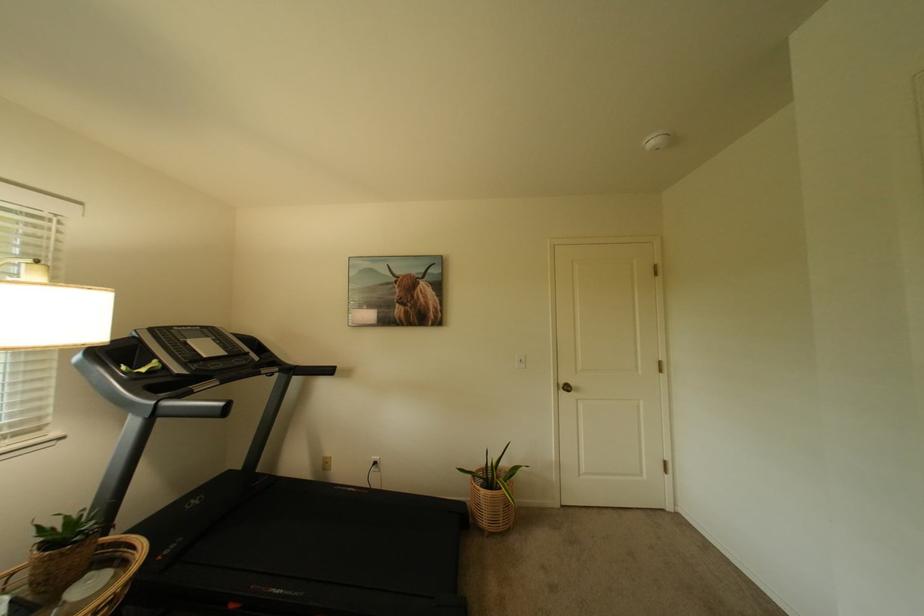
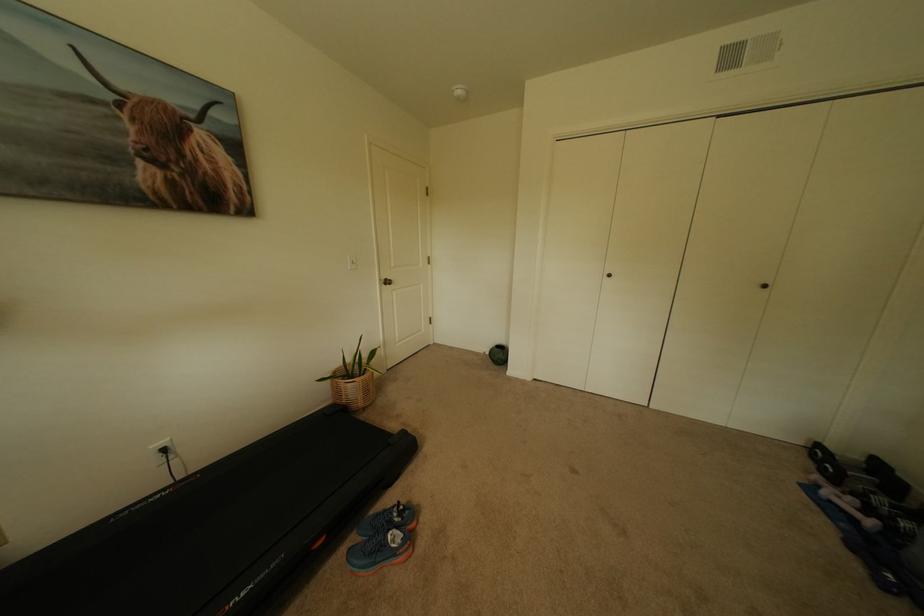
Locate, in the second image, the point that corresponds to point (495, 515) in the first image.

(370, 395)